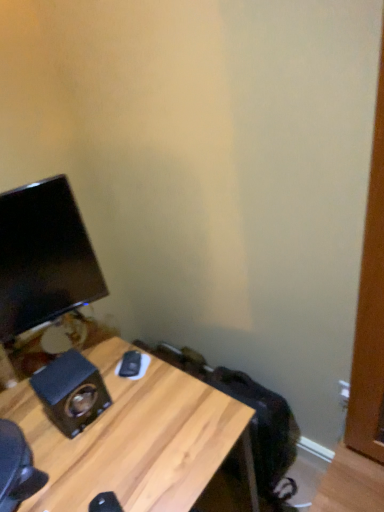
Locate an element on the screen. blank space above wooden desk at lower left (from a real-world perspective) is located at coordinates (94, 423).